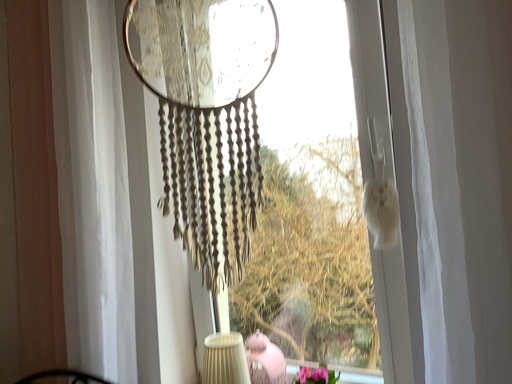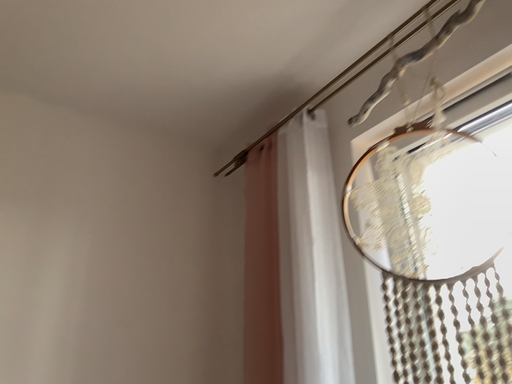
Question: How did the camera likely rotate when shooting the video?

Choices:
 (A) rotated upward
 (B) rotated downward

Answer: (A)